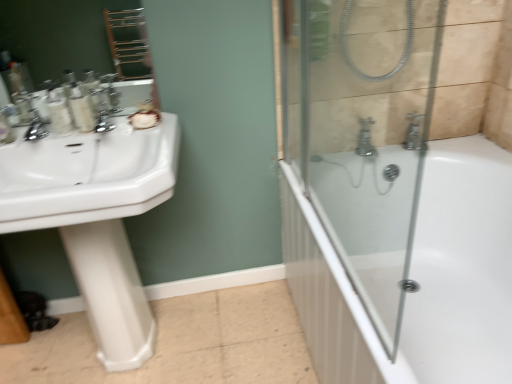
Where is `spots to the right of white glossy pedestal at left`? The width and height of the screenshot is (512, 384). spots to the right of white glossy pedestal at left is located at coordinates (185, 338).